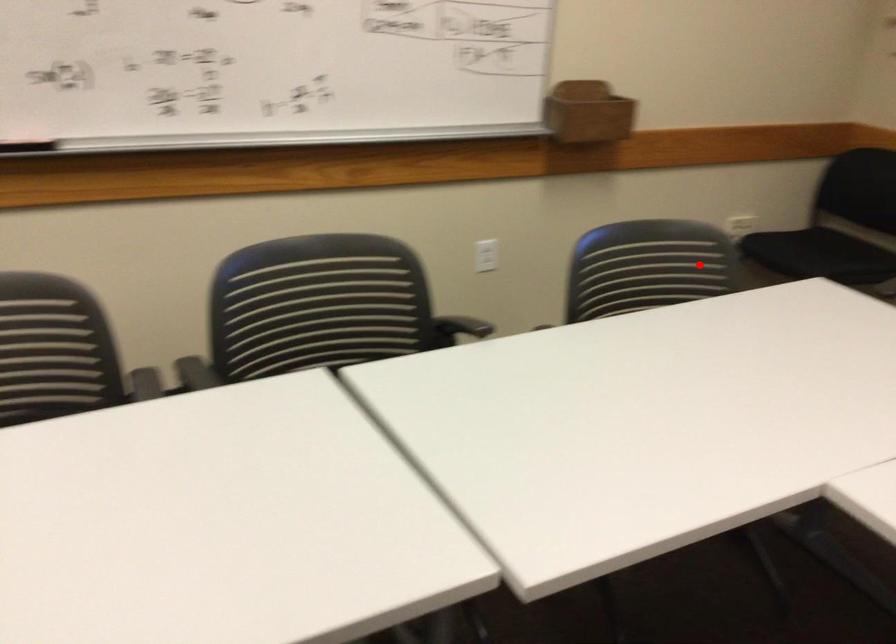
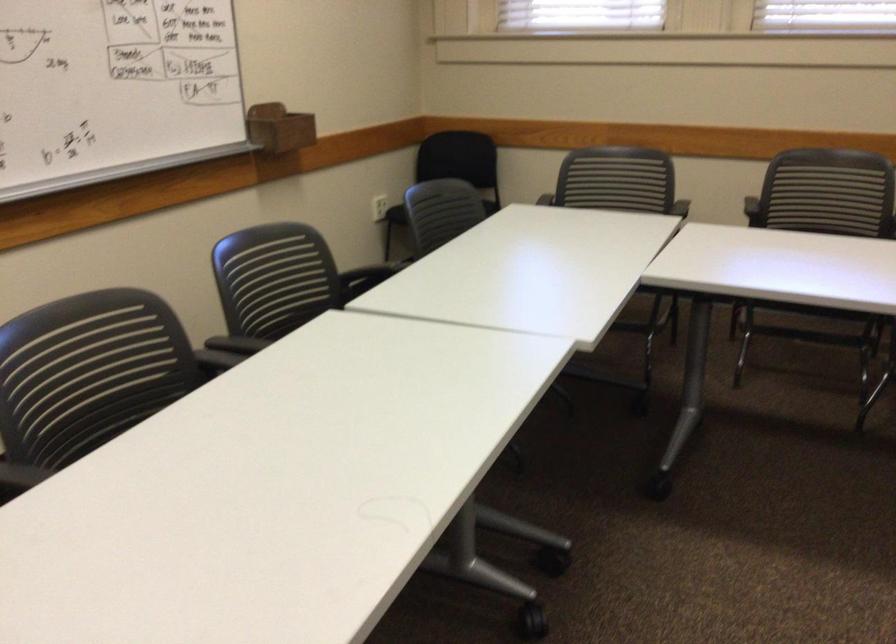
Question: I am providing you with two images of the same scene from different viewpoints. Given a red point in image1, look at the same physical point in image2. Is it:

Choices:
 (A) Closer to the viewpoint
 (B) Farther from the viewpoint

Answer: (B)